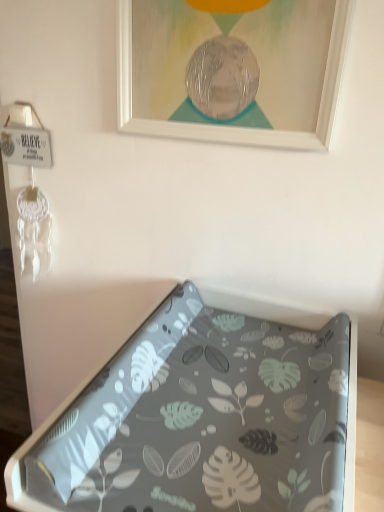
Question: Is white matte picture frame at upper center positioned in front of gray leaf-patterned tray at center?

Choices:
 (A) no
 (B) yes

Answer: (A)

Question: From the image's perspective, does white matte picture frame at upper center appear higher than gray leaf-patterned tray at center?

Choices:
 (A) no
 (B) yes

Answer: (B)

Question: Is white matte picture frame at upper center placed right next to gray leaf-patterned tray at center?

Choices:
 (A) no
 (B) yes

Answer: (A)

Question: Is white matte picture frame at upper center at the left side of gray leaf-patterned tray at center?

Choices:
 (A) no
 (B) yes

Answer: (B)

Question: Is white matte picture frame at upper center not inside gray leaf-patterned tray at center?

Choices:
 (A) yes
 (B) no

Answer: (A)

Question: Considering the relative sizes of white matte picture frame at upper center and gray leaf-patterned tray at center in the image provided, is white matte picture frame at upper center thinner than gray leaf-patterned tray at center?

Choices:
 (A) yes
 (B) no

Answer: (A)

Question: From a real-world perspective, is gray leaf-patterned tray at center beneath white matte picture frame at upper center?

Choices:
 (A) yes
 (B) no

Answer: (A)

Question: Could you tell me if gray leaf-patterned tray at center is turned towards white matte picture frame at upper center?

Choices:
 (A) yes
 (B) no

Answer: (B)

Question: Would you consider gray leaf-patterned tray at center to be distant from white matte picture frame at upper center?

Choices:
 (A) yes
 (B) no

Answer: (B)

Question: Is gray leaf-patterned tray at center beside white matte picture frame at upper center?

Choices:
 (A) no
 (B) yes

Answer: (A)

Question: From a real-world perspective, is gray leaf-patterned tray at center physically above white matte picture frame at upper center?

Choices:
 (A) yes
 (B) no

Answer: (B)

Question: From the image's perspective, does gray leaf-patterned tray at center appear lower than white matte picture frame at upper center?

Choices:
 (A) no
 (B) yes

Answer: (B)

Question: Is white matte picture frame at upper center in front of or behind gray leaf-patterned tray at center in the image?

Choices:
 (A) behind
 (B) front

Answer: (A)